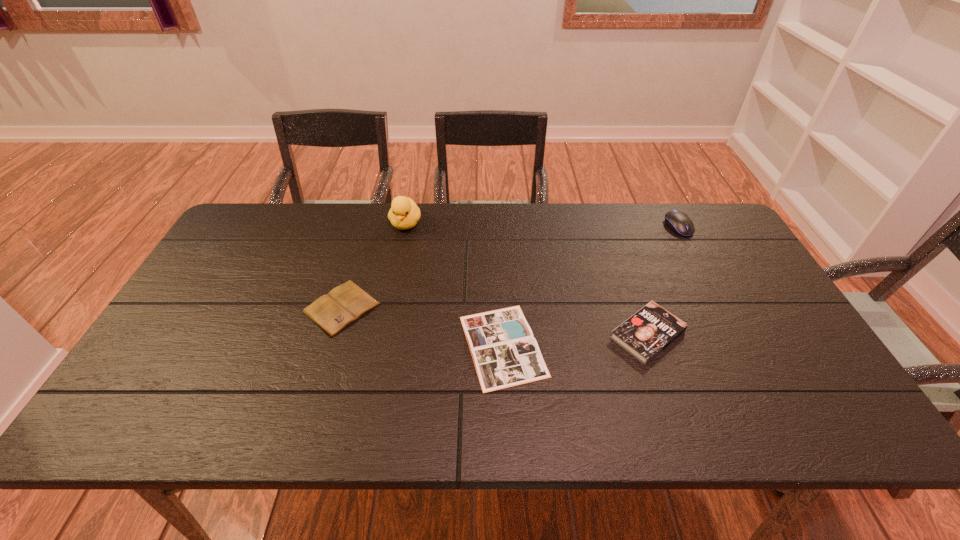
Where is `duck`? Image resolution: width=960 pixels, height=540 pixels. duck is located at coordinates (404, 214).

Image resolution: width=960 pixels, height=540 pixels. I want to click on computer mouse, so click(679, 222).

This screenshot has height=540, width=960. I want to click on the second tallest object, so click(679, 222).

You are a GUI agent. You are given a task and a screenshot of the screen. Output one action in this format:
    pyautogui.click(x=<x>, y=<y>)
    Task: Click on the second object from right to left
    
    Given the screenshot: What is the action you would take?
    pyautogui.click(x=649, y=331)

You are a GUI agent. You are given a task and a screenshot of the screen. Output one action in this format:
    pyautogui.click(x=<x>, y=<y>)
    Task: Click on the tallest book
    The image size is (960, 540).
    Given the screenshot: What is the action you would take?
    pyautogui.click(x=649, y=331)

Identify the location of the leftmost book. The image size is (960, 540). (343, 305).

Locate an element on the screen. The height and width of the screenshot is (540, 960). the third object from right to left is located at coordinates (505, 353).

You are a GUI agent. You are given a task and a screenshot of the screen. Output one action in this format:
    pyautogui.click(x=<x>, y=<y>)
    Task: Click on the blank space located 0.060m on the front-facing side of the tallest object
    
    Given the screenshot: What is the action you would take?
    pyautogui.click(x=401, y=248)

This screenshot has height=540, width=960. In order to click on blank area located 0.280m on the front of the rightmost object in this screenshot , I will do `click(718, 301)`.

Locate an element on the screen. This screenshot has width=960, height=540. vacant space located on the front of the third tallest object is located at coordinates (674, 411).